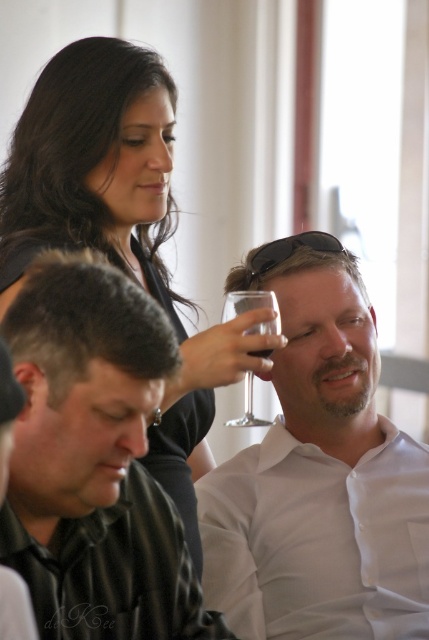
Question: Observing the image, what is the correct spatial positioning of black shirt at upper left in reference to transparent glass at upper center?

Choices:
 (A) left
 (B) right

Answer: (A)

Question: Which of the following is the closest to the observer?

Choices:
 (A) pos(48,502)
 (B) pos(241,301)

Answer: (A)

Question: Which point is farther to the camera?

Choices:
 (A) black shirt at upper left
 (B) black shirt at lower left

Answer: (A)

Question: Which object appears farthest from the camera in this image?

Choices:
 (A) white glossy shirt at upper center
 (B) black shirt at lower left

Answer: (A)

Question: Can you confirm if black shirt at lower left is positioned above transparent glass at upper center?

Choices:
 (A) no
 (B) yes

Answer: (A)

Question: Does white glossy shirt at upper center have a smaller size compared to black shirt at lower left?

Choices:
 (A) no
 (B) yes

Answer: (A)